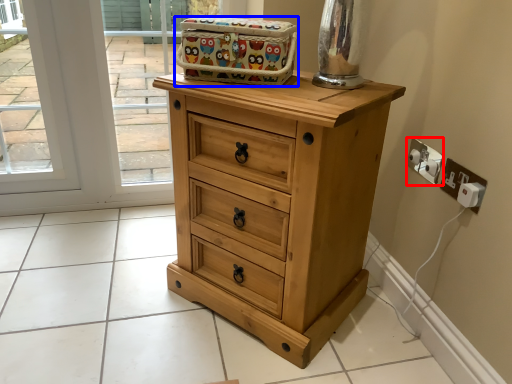
Question: Among these objects, which one is farthest to the camera, electric outlet (highlighted by a red box) or crate (highlighted by a blue box)?

Choices:
 (A) electric outlet
 (B) crate

Answer: (A)